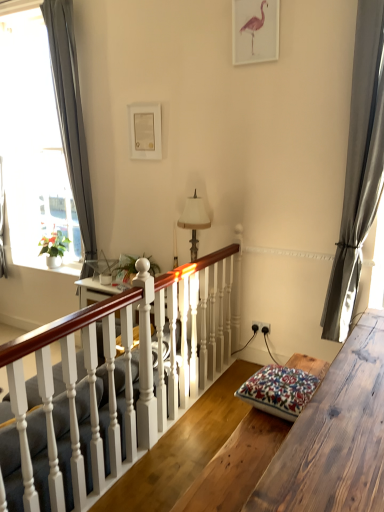
Question: Is gray fabric curtain at left, which appears as the 2th curtain when viewed from the front, oriented away from black plastic power outlet at center-right?

Choices:
 (A) no
 (B) yes

Answer: (A)

Question: Does gray fabric curtain at left, arranged as the 1th curtain when viewed from the back, have a greater width compared to black plastic power outlet at center-right?

Choices:
 (A) no
 (B) yes

Answer: (B)

Question: Does gray fabric curtain at left, arranged as the 1th curtain when viewed from the back, come in front of black plastic power outlet at center-right?

Choices:
 (A) no
 (B) yes

Answer: (A)

Question: Can you confirm if gray fabric curtain at left, which is counted as the 1th curtain, starting from the left, is smaller than black plastic power outlet at center-right?

Choices:
 (A) yes
 (B) no

Answer: (B)

Question: Does gray fabric curtain at left, which is the 2th curtain from right to left, have a lesser height compared to black plastic power outlet at center-right?

Choices:
 (A) no
 (B) yes

Answer: (A)

Question: Is floral-patterned fabric cushion at lower right in front of or behind matte pink flamingo at upper center, placed as the 2th picture frame when sorted from left to right, in the image?

Choices:
 (A) front
 (B) behind

Answer: (A)

Question: Considering the positions of floral-patterned fabric cushion at lower right and matte pink flamingo at upper center, the 1th picture frame in the top-to-bottom sequence, in the image, is floral-patterned fabric cushion at lower right wider or thinner than matte pink flamingo at upper center, the 1th picture frame in the top-to-bottom sequence,?

Choices:
 (A) wide
 (B) thin

Answer: (A)

Question: Looking at the image, does floral-patterned fabric cushion at lower right seem bigger or smaller compared to matte pink flamingo at upper center, which is counted as the second picture frame, starting from the bottom?

Choices:
 (A) big
 (B) small

Answer: (A)

Question: From the image's perspective, is floral-patterned fabric cushion at lower right positioned above or below matte pink flamingo at upper center, which is the 2th picture frame from back to front?

Choices:
 (A) above
 (B) below

Answer: (B)

Question: Is satin gray curtain at right, the second curtain in the back-to-front sequence, taller or shorter than white painted wood stairs at center?

Choices:
 (A) tall
 (B) short

Answer: (A)

Question: Relative to white painted wood stairs at center, is satin gray curtain at right, which is counted as the first curtain, starting from the front, in front or behind?

Choices:
 (A) front
 (B) behind

Answer: (B)

Question: In terms of width, does satin gray curtain at right, which is counted as the first curtain, starting from the right, look wider or thinner when compared to white painted wood stairs at center?

Choices:
 (A) wide
 (B) thin

Answer: (B)

Question: From a real-world perspective, is satin gray curtain at right, which is counted as the first curtain, starting from the right, positioned above or below white painted wood stairs at center?

Choices:
 (A) above
 (B) below

Answer: (A)

Question: Is matte pink flamingo at upper center, placed as the 2th picture frame when sorted from left to right, in front of or behind floral-patterned fabric cushion at lower right in the image?

Choices:
 (A) front
 (B) behind

Answer: (B)

Question: In terms of height, does matte pink flamingo at upper center, marked as the 1th picture frame in a right-to-left arrangement, look taller or shorter compared to floral-patterned fabric cushion at lower right?

Choices:
 (A) short
 (B) tall

Answer: (B)